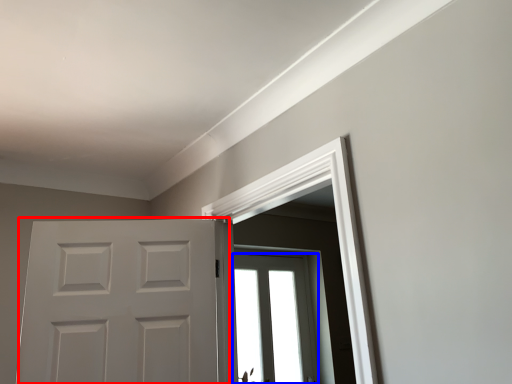
Question: Which object appears farthest to the camera in this image, door (highlighted by a red box) or window (highlighted by a blue box)?

Choices:
 (A) door
 (B) window

Answer: (B)